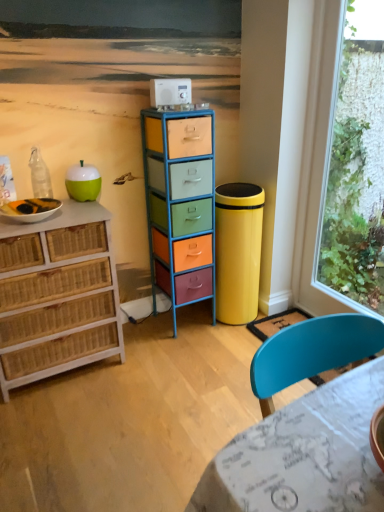
At what (x,y) coordinates should I click in order to perform the action: click on vacant area situated below white matte bowl at left (from a real-world perspective). Please return your answer as a coordinate pair (x, y). This screenshot has height=512, width=384. Looking at the image, I should click on (33, 219).